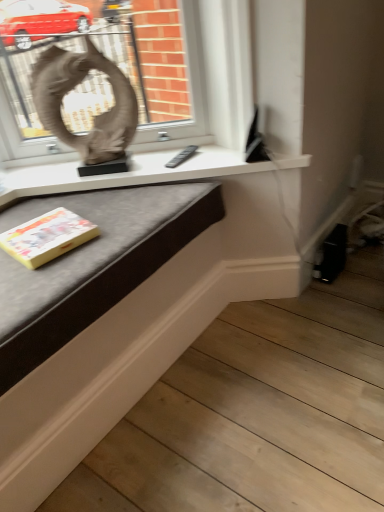
Where is `free space on the front side of matte gray sculpture at upper left`? free space on the front side of matte gray sculpture at upper left is located at coordinates (99, 202).